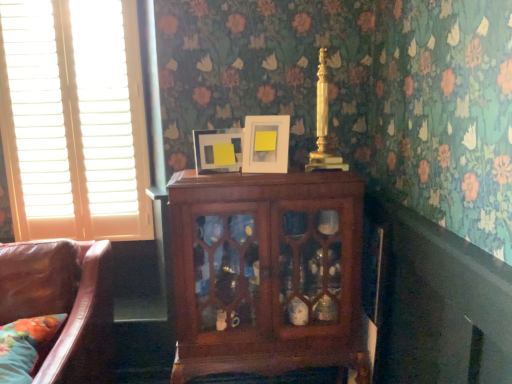
This screenshot has width=512, height=384. Identify the location of space that is in front of gold polished candle holder at upper center. (326, 177).